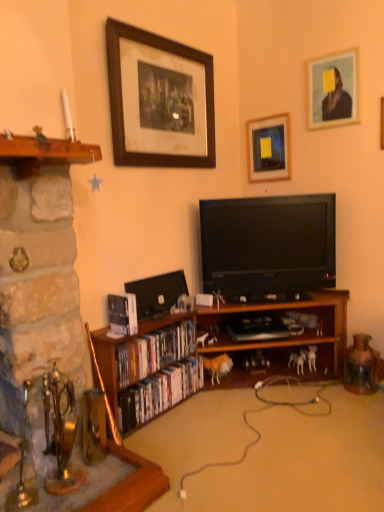
Question: Considering the positions of wooden picture frame at upper right, the first picture frame in the right-to-left sequence, and stone fireplace at left in the image, is wooden picture frame at upper right, the first picture frame in the right-to-left sequence, bigger or smaller than stone fireplace at left?

Choices:
 (A) small
 (B) big

Answer: (A)

Question: From the image's perspective, relative to stone fireplace at left, is wooden picture frame at upper right, the third picture frame from the left, above or below?

Choices:
 (A) below
 (B) above

Answer: (B)

Question: Which of these objects is positioned farthest from the wooden framed print at upper center, the 3th picture frame in the right-to-left sequence?

Choices:
 (A) wooden bookshelf at center
 (B) hardcover book at lower left, which is the first book in top-to-bottom order
 (C) stone fireplace at left
 (D) wooden dvd case at lower left, which is the 2th book from bottom to top
 (E) wooden picture frame at upper right, the first picture frame in the right-to-left sequence

Answer: (A)

Question: Which of these objects is positioned closest to the stone fireplace at left?

Choices:
 (A) black glossy flat-screen tv at center
 (B) wooden framed print at upper center, acting as the 1th picture frame starting from the left
 (C) matte black picture frame at upper center, placed as the second picture frame when sorted from right to left
 (D) wooden bookshelf at center
 (E) wooden dvd case at lower left, the 2th book from the top

Answer: (E)